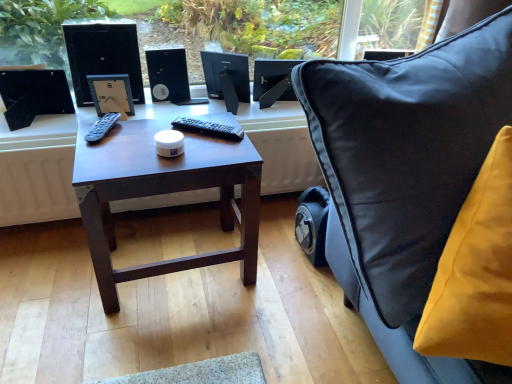
Where is `vacant region to the left of dark wood table at center`? vacant region to the left of dark wood table at center is located at coordinates (55, 277).